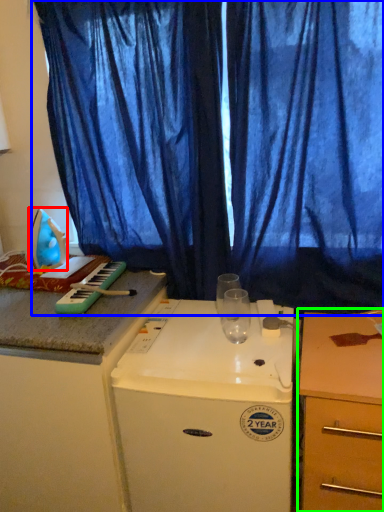
Question: Which is nearer to the appliance (highlighted by a red box)? curtain (highlighted by a blue box) or desk (highlighted by a green box).

Choices:
 (A) curtain
 (B) desk

Answer: (A)